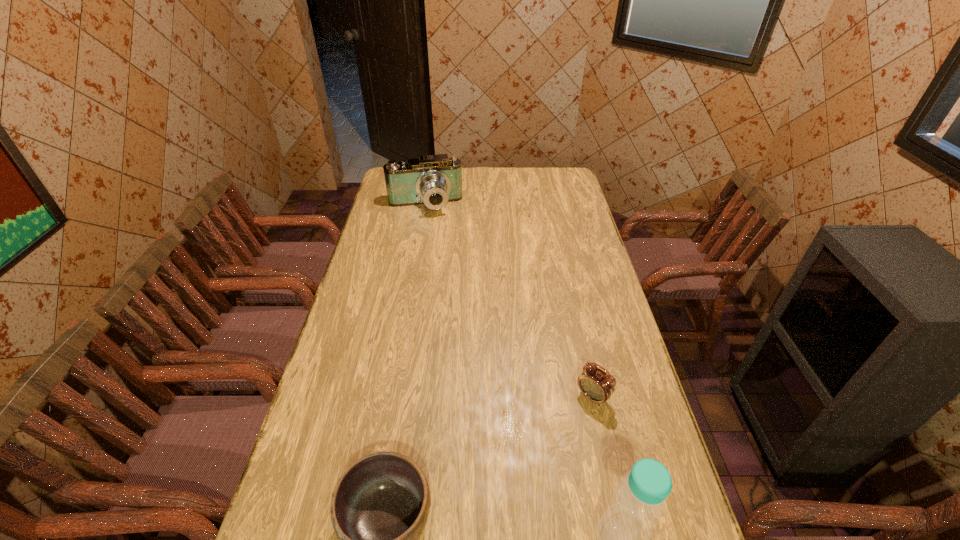
Locate an element on the screen. The image size is (960, 540). the second tallest object is located at coordinates (435, 180).

You are a GUI agent. You are given a task and a screenshot of the screen. Output one action in this format:
    pyautogui.click(x=<x>, y=<y>)
    Task: Click on the camcorder
    The width and height of the screenshot is (960, 540).
    Given the screenshot: What is the action you would take?
    pyautogui.click(x=435, y=180)

Where is `the third nearest object`? Image resolution: width=960 pixels, height=540 pixels. the third nearest object is located at coordinates (598, 386).

This screenshot has width=960, height=540. What are the coordinates of `free space located 0.170m on the front-facing side of the camcorder` in the screenshot? It's located at (433, 240).

Identify the location of vacant area situated on the front-facing side of the camcorder. (431, 225).

In order to click on free spot located on the front-facing side of the camcorder in this screenshot , I will do `click(438, 268)`.

I want to click on free space located on the face of the alarm clock, so click(508, 492).

The width and height of the screenshot is (960, 540). I want to click on free spot located on the face of the alarm clock, so click(x=551, y=444).

Image resolution: width=960 pixels, height=540 pixels. What are the coordinates of `free region located 0.280m on the face of the alarm clock` in the screenshot? It's located at (518, 480).

At what (x,y) coordinates should I click in order to perform the action: click on object that is positioned at the left edge. Please return your answer as a coordinate pair (x, y). The width and height of the screenshot is (960, 540). Looking at the image, I should click on point(435,180).